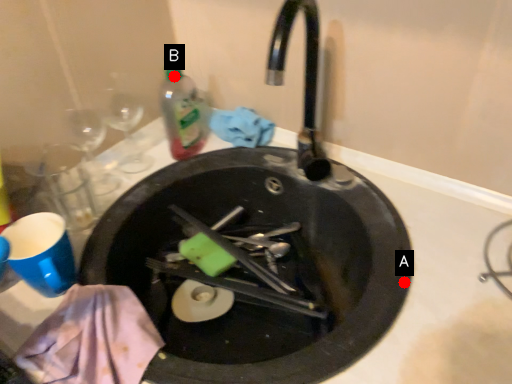
Question: Two points are circled on the image, labeled by A and B beside each circle. Which point appears farthest from the camera in this image?

Choices:
 (A) A is further
 (B) B is further

Answer: (B)